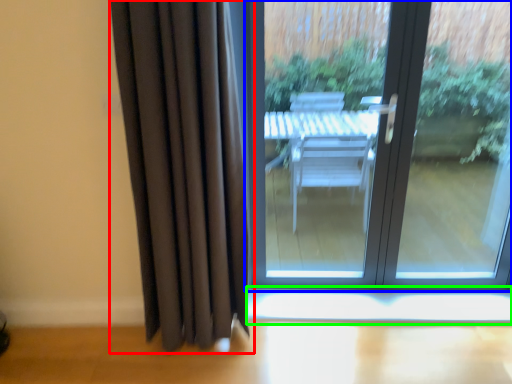
Question: Considering the real-world distances, which object is closest to curtain (highlighted by a red box)? door (highlighted by a blue box) or window sill (highlighted by a green box).

Choices:
 (A) door
 (B) window sill

Answer: (B)